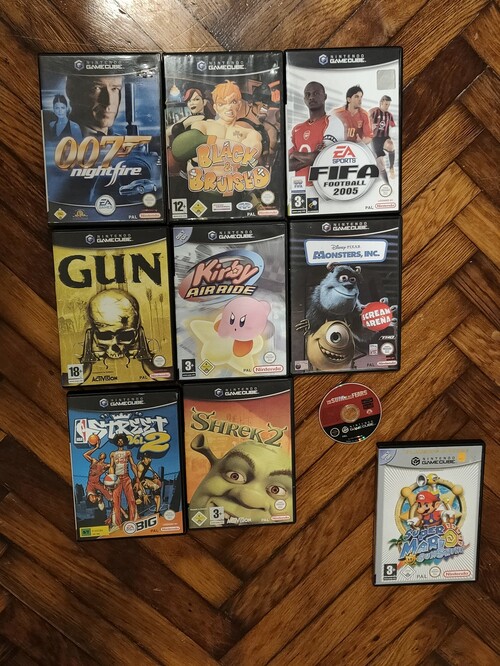
The height and width of the screenshot is (666, 500). Find the location of `gamecube game disc cases`. gamecube game disc cases is located at coordinates (445, 507), (250, 448), (122, 447), (127, 304), (219, 302), (358, 274), (348, 119), (195, 130), (132, 125).